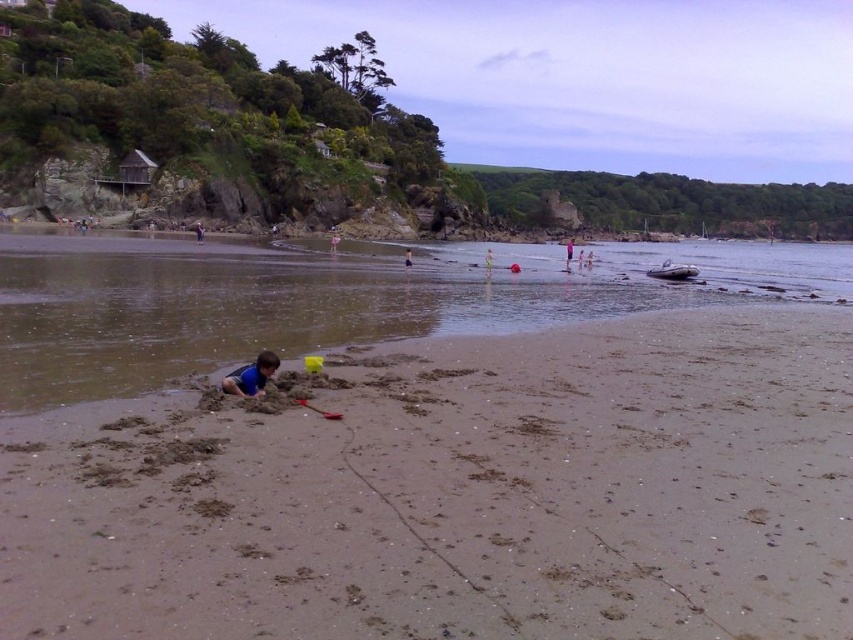
Based on the photo, you are a photographer planning to take a group photo of the blue fabric person at lower left and the light pink fabric at center. Which of the two should you position closer to the camera to ensure they appear the same size in the photo?

The blue fabric person at lower left has a lesser width compared to the light pink fabric at center. To make them appear the same size in the photo, position the blue fabric person at lower left closer to the camera since it is narrower and needs to be magnified more to match the size of the light pink fabric at center.

You are standing at the camera position looking at the beach scene. There are two points marked in the image, one at coordinates point (28, 257) and the other at point (488, 259). Which point is closer to you?

Point (28, 257) is closer to the camera than point (488, 259).